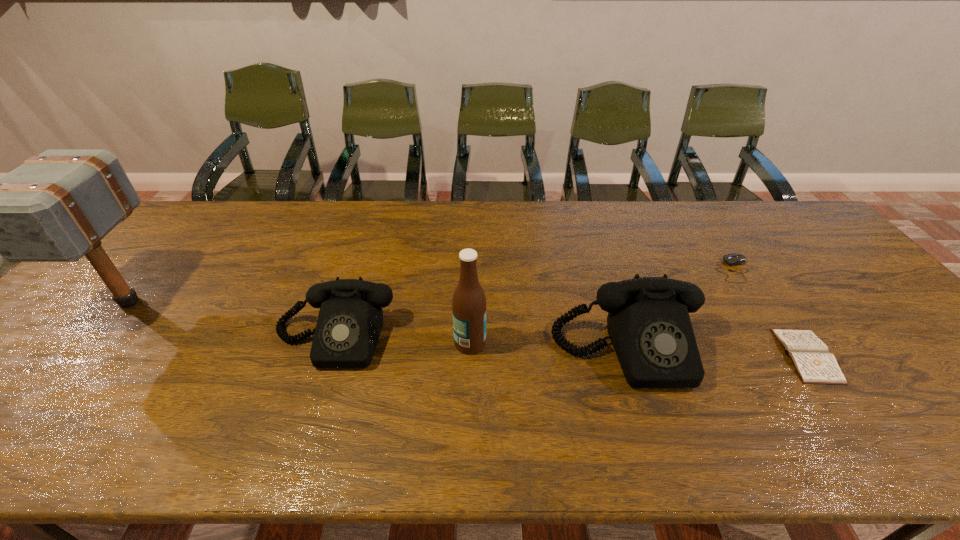
The height and width of the screenshot is (540, 960). I want to click on free spot that satisfies the following two spatial constraints: 1. on the dial of the third object from right to left; 2. on the left side of the shortest object, so click(x=629, y=355).

Identify the location of free location that satisfies the following two spatial constraints: 1. on the striking surface of the shortest object; 2. on the left side of the mallet. Image resolution: width=960 pixels, height=540 pixels. (84, 355).

Locate an element on the screen. The height and width of the screenshot is (540, 960). free space that satisfies the following two spatial constraints: 1. on the dial of the shortest object; 2. on the right side of the fifth object from right to left is located at coordinates (328, 355).